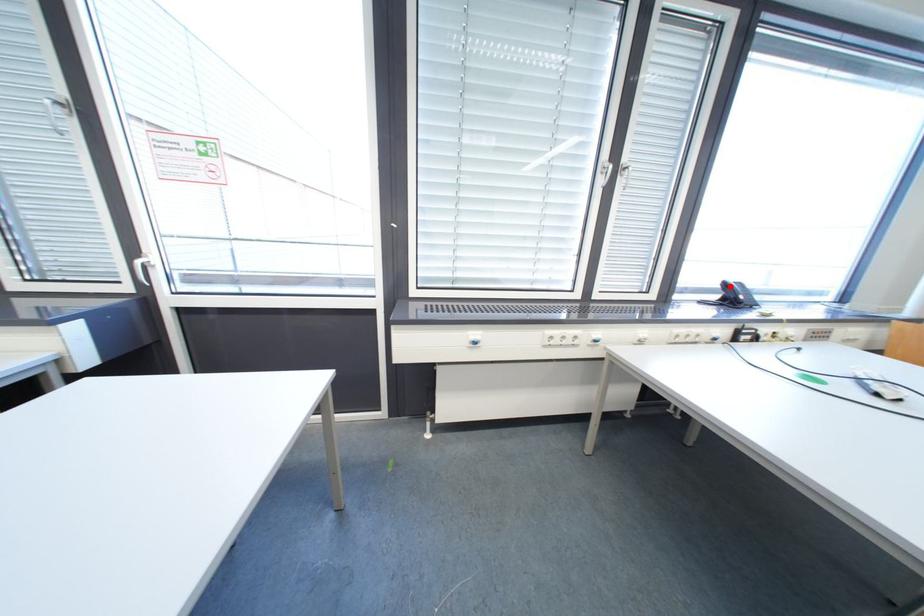
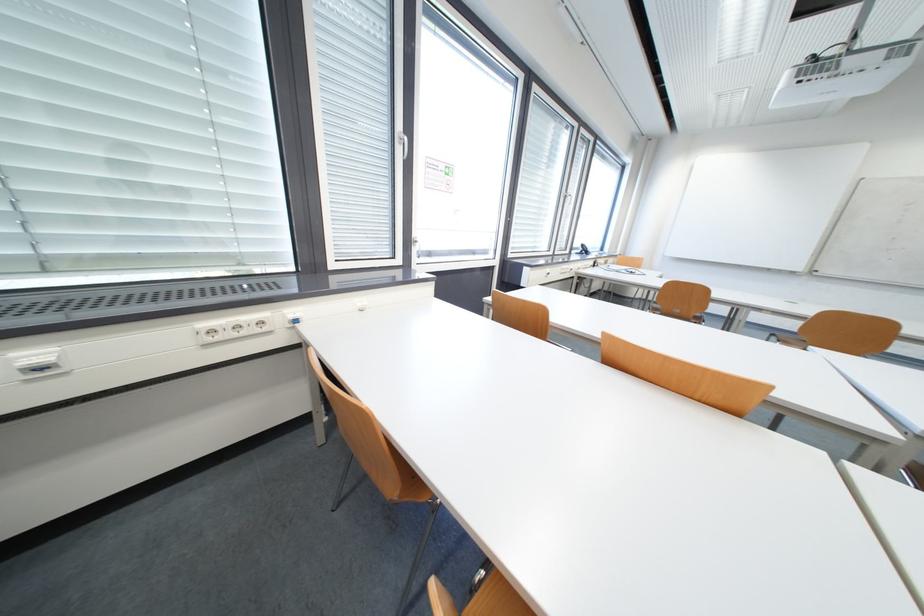
Where in the second image is the point corresponding to the highlighted location from the first image?

(588, 246)